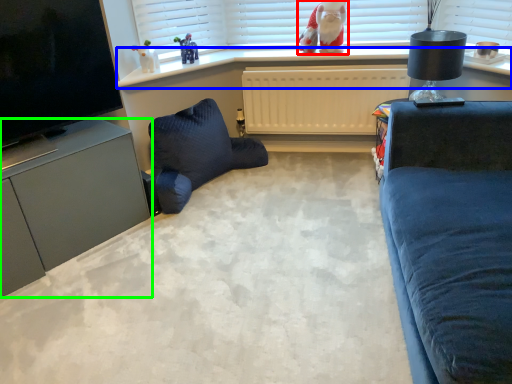
Question: Which object is the closest to the doll (highlighted by a red box)? Choose among these: window sill (highlighted by a blue box) or cabinetry (highlighted by a green box).

Choices:
 (A) window sill
 (B) cabinetry

Answer: (A)